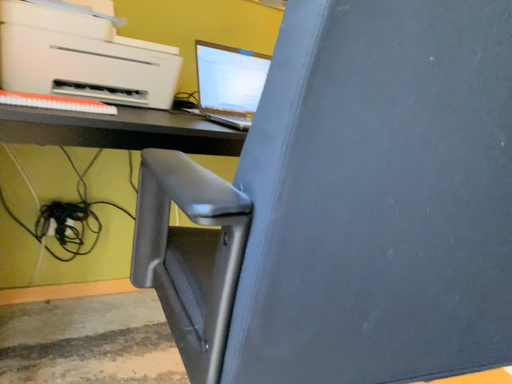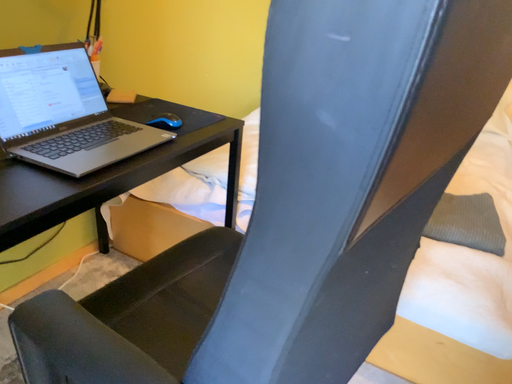
Question: Which way did the camera rotate in the video?

Choices:
 (A) rotated right
 (B) rotated left

Answer: (A)